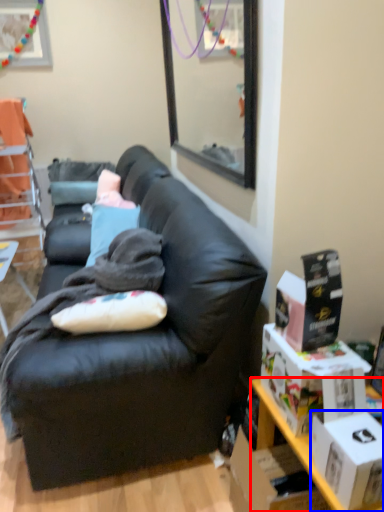
Question: Which of the following is the farthest to the observer, desk (highlighted by a red box) or box (highlighted by a blue box)?

Choices:
 (A) desk
 (B) box

Answer: (A)